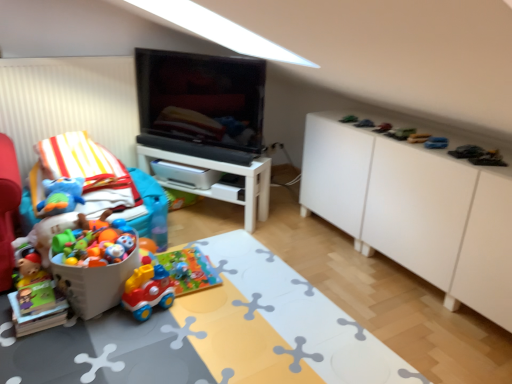
Identify the location of free space in front of green plastic toy car at upper right, the seventh toy in the left-to-right sequence. This screenshot has width=512, height=384. (417, 143).